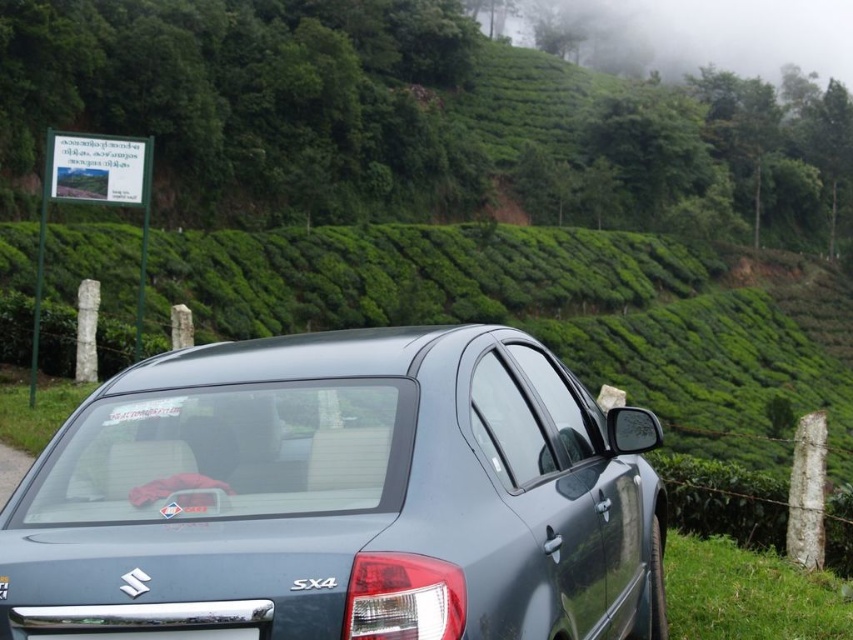
You are a delivery drone operator. Your drone needs to land on the grassy area near the satin metallic car at center. According to the coordinates provided, where should the drone aim to land?

The satin metallic car at center is located at point (343, 496), so the drone should aim to land near that coordinate on the grassy area.

You are standing at the point marked by the coordinates point (343,496) in the image. What object are you directly positioned on?

The point (343,496) marks the satin metallic car at center, so you are directly positioned on the satin metallic car at center.